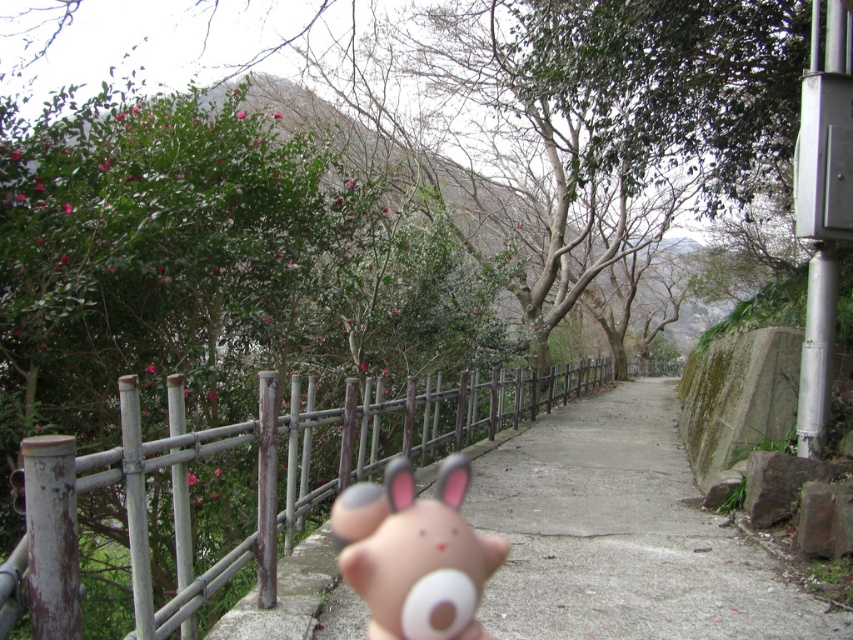
Question: Is concrete at center above matte plastic toy at center?

Choices:
 (A) no
 (B) yes

Answer: (A)

Question: Which of these objects is positioned farthest from the concrete at center?

Choices:
 (A) wooden fence at center
 (B) matte plastic toy at center

Answer: (A)

Question: Which of the following is the farthest from the observer?

Choices:
 (A) pos(231,428)
 (B) pos(531,582)

Answer: (B)

Question: Can you confirm if concrete at center is positioned to the right of matte plastic toy at center?

Choices:
 (A) no
 (B) yes

Answer: (B)

Question: Which of the following is the farthest from the observer?

Choices:
 (A) concrete at center
 (B) wooden fence at center

Answer: (A)

Question: Can you confirm if wooden fence at center is thinner than matte plastic toy at center?

Choices:
 (A) no
 (B) yes

Answer: (A)